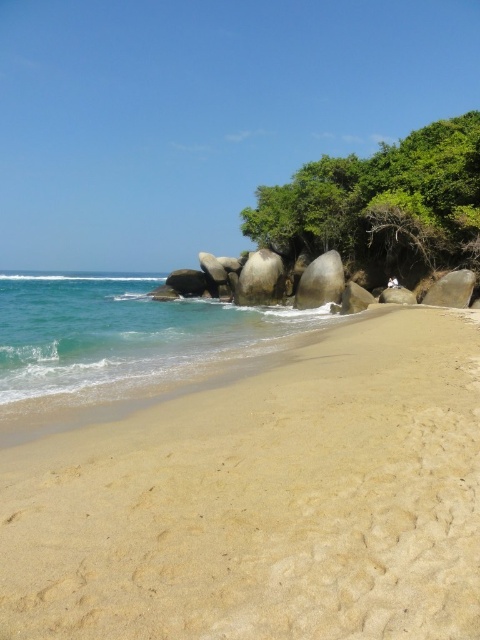
Question: Does light beige sand at center have a lesser width compared to smooth granite boulder at center?

Choices:
 (A) no
 (B) yes

Answer: (A)

Question: Can you confirm if light beige sand at center is wider than gray smooth rock at center-right?

Choices:
 (A) yes
 (B) no

Answer: (A)

Question: Does light beige sand at center appear over smooth granite boulder at center?

Choices:
 (A) yes
 (B) no

Answer: (B)

Question: Which point is farther to the camera?

Choices:
 (A) smooth gray rock at center-right
 (B) gray smooth rock at center-right
 (C) smooth gray rock at center
 (D) smooth granite boulder at center

Answer: (D)

Question: Considering the real-world distances, which object is farthest from the smooth gray rock at center-right?

Choices:
 (A) smooth granite boulder at center
 (B) gray smooth rock at center-right

Answer: (A)

Question: Which of the following is the farthest from the observer?

Choices:
 (A) (379, 426)
 (B) (325, 280)

Answer: (B)